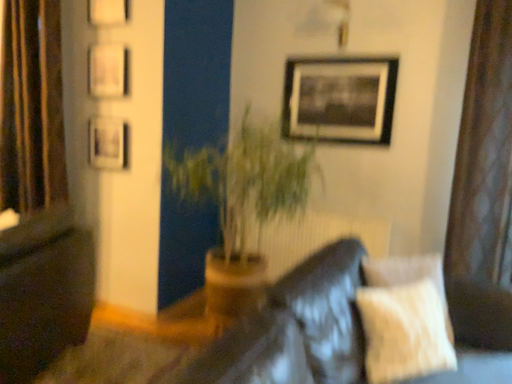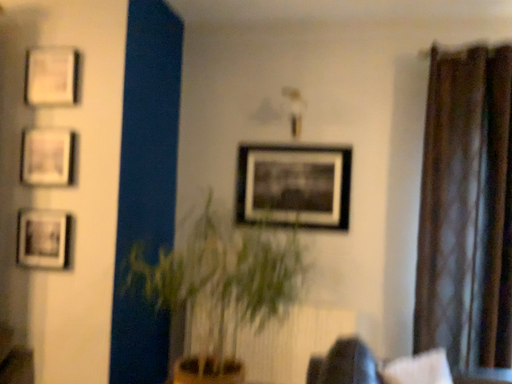
Question: Which way did the camera rotate in the video?

Choices:
 (A) rotated left
 (B) rotated right

Answer: (B)